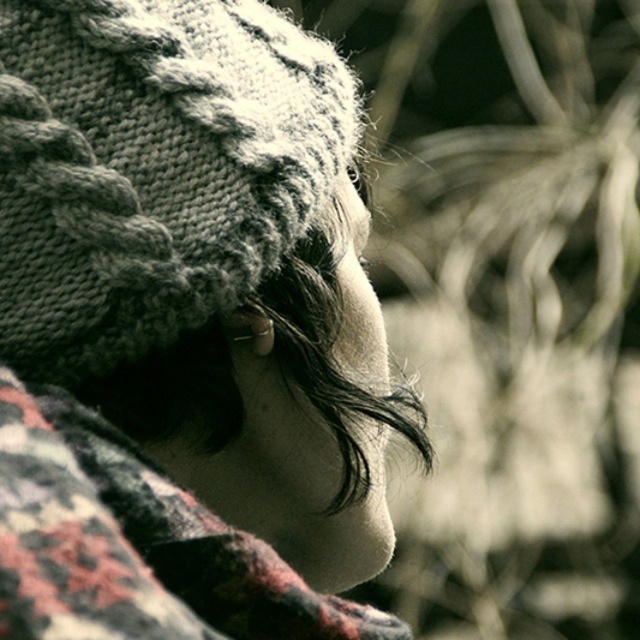
You are a photographer standing 30 centimeters away from the knitted woolen hat at upper left. Can you safely step forward to take a closer shot without touching the hat?

The knitted woolen hat at upper left and viewer are 32.59 centimeters apart. Since you are currently 30 centimeters away, you are already closer than the stated distance, which might mean you have already moved forward beyond the safe distance. To avoid touching the hat, you should maintain the original position at 32.59 centimeters.

You are a photographer adjusting your camera settings. You notice a point at coordinates [186,328] in the image. Based on the scene description, what object is located at that point?

The point at coordinates [186,328] corresponds to the knitted woolen hat at upper left.

Looking at this image, you are a photographer adjusting your camera settings to focus on the knitted woolen hat at upper left and the plaid wool shawl at center. Since the background is blurred, which object will appear more in focus?

The knitted woolen hat at upper left will appear more in focus because it is closer to the camera than the plaid wool shawl at center, which is behind it.